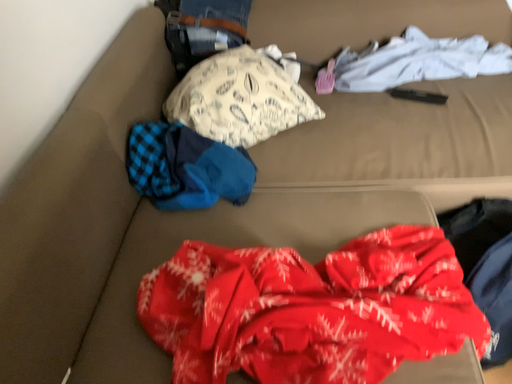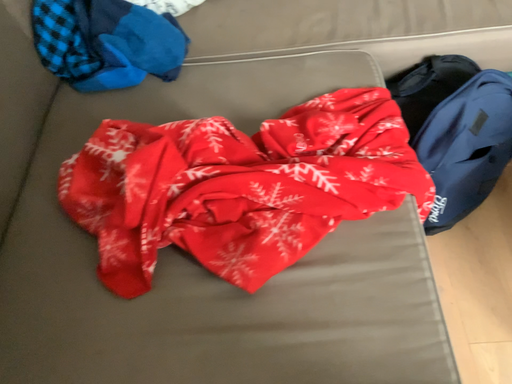
Question: How did the camera likely rotate when shooting the video?

Choices:
 (A) rotated upward
 (B) rotated downward

Answer: (B)